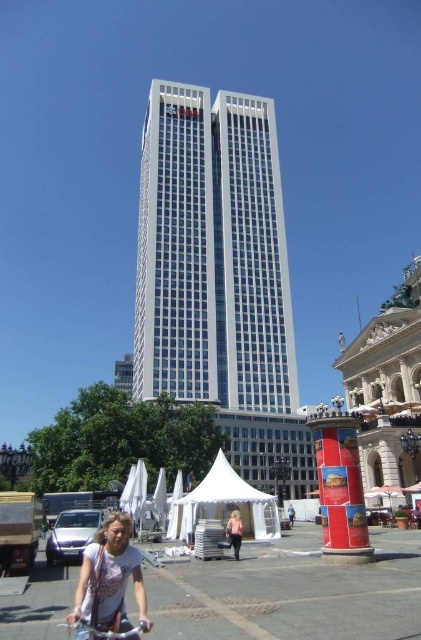
You are standing at the center of the square and want to quickly find the silver metallic bicycle at lower center. According to the coordinates provided, in which direction should you look relative to your position?

The silver metallic bicycle at lower center is located at coordinates point (108, 628). Since the x and y coordinates are both close to 1, you should look towards the lower right direction from your current position at the center.

You are standing in the square and want to take a photo of the white glass building at center without any obstructions. Is the silver metallic bicycle at lower center blocking your view of the building?

The silver metallic bicycle at lower center is behind the white glass building at center, so it won not block your view of the building.

You are standing at the camera position and want to take a photo of the white glass building at center. If your camera has a maximum focus range of 60 meters, will you be able to capture the building clearly?

The white glass building at center and camera are 68.28 meters apart, which exceeds the camera maximum focus range of 60 meters. So you cannot capture the building clearly.